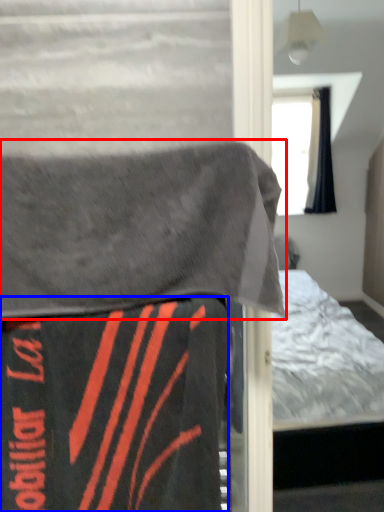
Question: Which point is further to the camera, blanket (highlighted by a red box) or blanket (highlighted by a blue box)?

Choices:
 (A) blanket
 (B) blanket

Answer: (B)